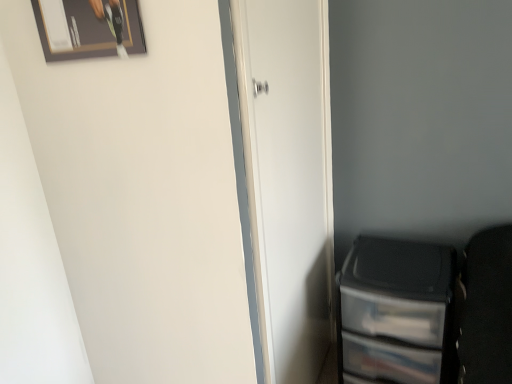
Question: Can you confirm if transparent plastic file cabinet at lower right is smaller than wooden framed picture at upper left?

Choices:
 (A) yes
 (B) no

Answer: (B)

Question: Is transparent plastic file cabinet at lower right positioned before wooden framed picture at upper left?

Choices:
 (A) no
 (B) yes

Answer: (A)

Question: From the image's perspective, would you say transparent plastic file cabinet at lower right is shown under wooden framed picture at upper left?

Choices:
 (A) no
 (B) yes

Answer: (B)

Question: Is the surface of transparent plastic file cabinet at lower right in direct contact with wooden framed picture at upper left?

Choices:
 (A) yes
 (B) no

Answer: (B)

Question: Is transparent plastic file cabinet at lower right bigger than wooden framed picture at upper left?

Choices:
 (A) no
 (B) yes

Answer: (B)

Question: Considering their positions, is transparent plastic file cabinet at lower right located in front of or behind white matte door at center?

Choices:
 (A) behind
 (B) front

Answer: (A)

Question: In terms of height, does transparent plastic file cabinet at lower right look taller or shorter compared to white matte door at center?

Choices:
 (A) short
 (B) tall

Answer: (A)

Question: Based on their sizes in the image, would you say transparent plastic file cabinet at lower right is bigger or smaller than white matte door at center?

Choices:
 (A) big
 (B) small

Answer: (A)

Question: Is transparent plastic file cabinet at lower right inside or outside of white matte door at center?

Choices:
 (A) outside
 (B) inside

Answer: (A)

Question: From a real-world perspective, is wooden framed picture at upper left positioned above or below white matte door at center?

Choices:
 (A) below
 (B) above

Answer: (B)

Question: From the image's perspective, is wooden framed picture at upper left above or below white matte door at center?

Choices:
 (A) above
 (B) below

Answer: (A)

Question: Is wooden framed picture at upper left inside or outside of white matte door at center?

Choices:
 (A) inside
 (B) outside

Answer: (B)

Question: Considering the positions of wooden framed picture at upper left and white matte door at center in the image, is wooden framed picture at upper left taller or shorter than white matte door at center?

Choices:
 (A) tall
 (B) short

Answer: (B)

Question: In the image, is transparent plastic file cabinet at lower right positioned in front of or behind wooden framed picture at upper left?

Choices:
 (A) front
 (B) behind

Answer: (B)

Question: Considering the positions of point (368, 324) and point (54, 1), is point (368, 324) closer or farther from the camera than point (54, 1)?

Choices:
 (A) farther
 (B) closer

Answer: (A)